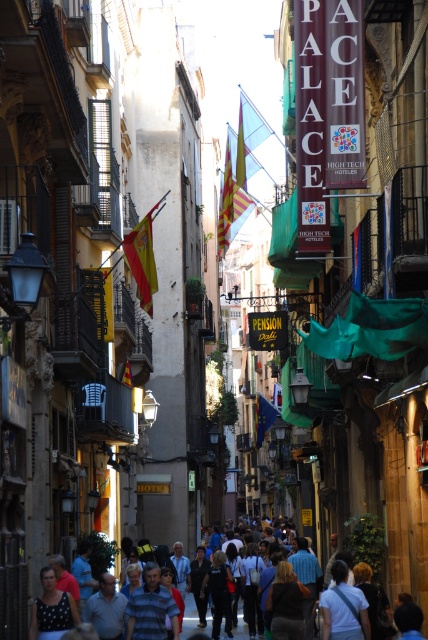
You are a tourist standing on the street and want to take a photo of the light blue shirt at center without the matte fabric flag at center appearing in the frame. Is this possible?

The matte fabric flag at center is located above the light blue shirt at center, so if you position yourself directly in front of the light blue shirt at center and angle the camera slightly downward, you can avoid capturing the flag in the frame.

You are a tourist standing at the center of the street in the European city scene. You notice a flag at the specified coordinates. What type of flag is located at point (142, 259)?

The point (142, 259) marks the location of the matte fabric flag at center.

You are a tourist standing on the street and want to take a photo of both the yellow fabric flag at center and the matte fabric flag at center. Given that your camera can focus on objects within 20 meters, will you be able to capture both flags in one shot?

The yellow fabric flag at center is 22.46 meters away from matte fabric flag at center. Since the distance between them exceeds the camera focus range of 20 meters, you cannot capture both flags in one shot.